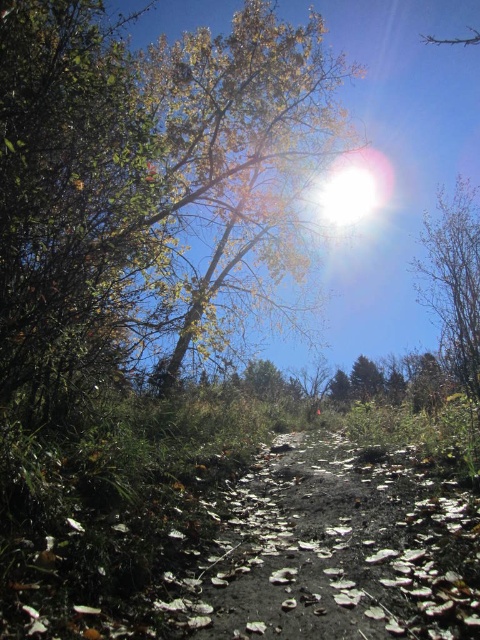
Question: Estimate the real-world distances between objects in this image. Which object is closer to the brown dirt path at center?

Choices:
 (A) bare branches at right
 (B) yellow-green leaves at upper center

Answer: (B)

Question: Among these objects, which one is nearest to the camera?

Choices:
 (A) yellow-green leaves at upper center
 (B) brown dirt path at center
 (C) bare branches at right

Answer: (B)

Question: Is yellow-green leaves at upper center further to the viewer compared to bare branches at right?

Choices:
 (A) no
 (B) yes

Answer: (A)

Question: Is yellow-green leaves at upper center positioned at the back of bare branches at right?

Choices:
 (A) no
 (B) yes

Answer: (A)

Question: Is yellow-green leaves at upper center smaller than bare branches at right?

Choices:
 (A) no
 (B) yes

Answer: (B)

Question: Among these points, which one is farthest from the camera?

Choices:
 (A) (330, 433)
 (B) (457, 365)
 (C) (195, 122)

Answer: (B)